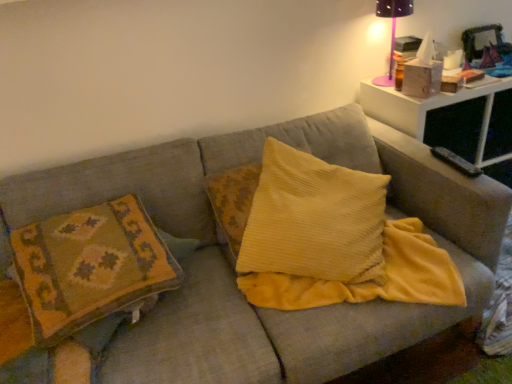
Question: Does textured fabric couch at center have a lesser height compared to pink plastic table lamp at upper right?

Choices:
 (A) yes
 (B) no

Answer: (B)

Question: Can you confirm if textured fabric couch at center is thinner than pink plastic table lamp at upper right?

Choices:
 (A) no
 (B) yes

Answer: (A)

Question: Is textured fabric couch at center smaller than pink plastic table lamp at upper right?

Choices:
 (A) yes
 (B) no

Answer: (B)

Question: From a real-world perspective, is textured fabric couch at center physically above pink plastic table lamp at upper right?

Choices:
 (A) yes
 (B) no

Answer: (B)

Question: From the image's perspective, is textured fabric couch at center over pink plastic table lamp at upper right?

Choices:
 (A) no
 (B) yes

Answer: (A)

Question: Looking at their shapes, would you say yellow corduroy pillow at center, the second pillow from the left, is wider or thinner than pink plastic table lamp at upper right?

Choices:
 (A) wide
 (B) thin

Answer: (A)

Question: Do you think yellow corduroy pillow at center, positioned as the first pillow in right-to-left order, is within pink plastic table lamp at upper right, or outside of it?

Choices:
 (A) inside
 (B) outside

Answer: (B)

Question: In the image, is yellow corduroy pillow at center, the second pillow from the left, on the left side or the right side of pink plastic table lamp at upper right?

Choices:
 (A) left
 (B) right

Answer: (A)

Question: In terms of size, does yellow corduroy pillow at center, the second pillow from the left, appear bigger or smaller than pink plastic table lamp at upper right?

Choices:
 (A) small
 (B) big

Answer: (B)

Question: Does point (53, 324) appear closer or farther from the camera than point (416, 104)?

Choices:
 (A) farther
 (B) closer

Answer: (B)

Question: Is textured woolen pillow at left, which is counted as the second pillow, starting from the right, situated inside white plastic table at upper right or outside?

Choices:
 (A) inside
 (B) outside

Answer: (B)

Question: Is textured woolen pillow at left, which is counted as the second pillow, starting from the right, bigger or smaller than white plastic table at upper right?

Choices:
 (A) small
 (B) big

Answer: (A)

Question: Considering the positions of textured woolen pillow at left, which is counted as the second pillow, starting from the right, and white plastic table at upper right in the image, is textured woolen pillow at left, which is counted as the second pillow, starting from the right, wider or thinner than white plastic table at upper right?

Choices:
 (A) wide
 (B) thin

Answer: (B)

Question: Is point (395, 9) closer or farther from the camera than point (475, 89)?

Choices:
 (A) closer
 (B) farther

Answer: (B)

Question: Is pink plastic table lamp at upper right spatially inside white plastic table at upper right, or outside of it?

Choices:
 (A) inside
 (B) outside

Answer: (B)